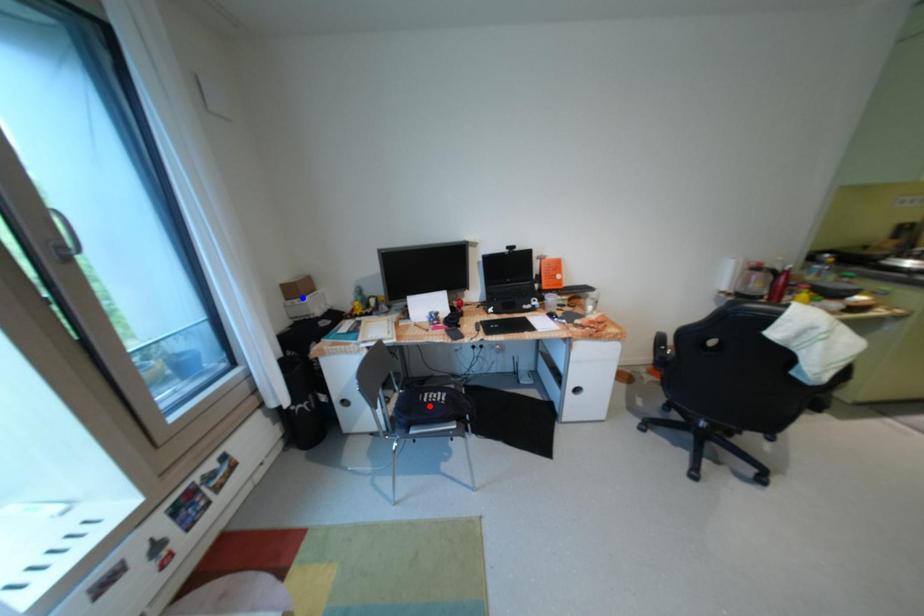
Question: Two points are marked on the image. Which point is closer to the camera?

Choices:
 (A) Blue point is closer.
 (B) Red point is closer.

Answer: (B)